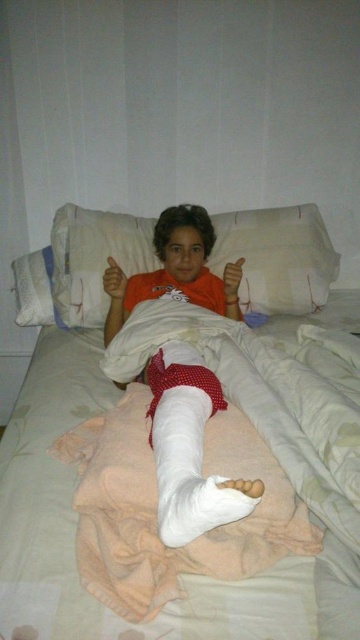
You are a nurse checking on a patient in a hospital room. You see the white bandage at center and the matte orange hand at center. Which object is located to the right of the other?

The white bandage at center is positioned on the right side of matte orange hand at center, so the white bandage at center is to the right of the matte orange hand at center.